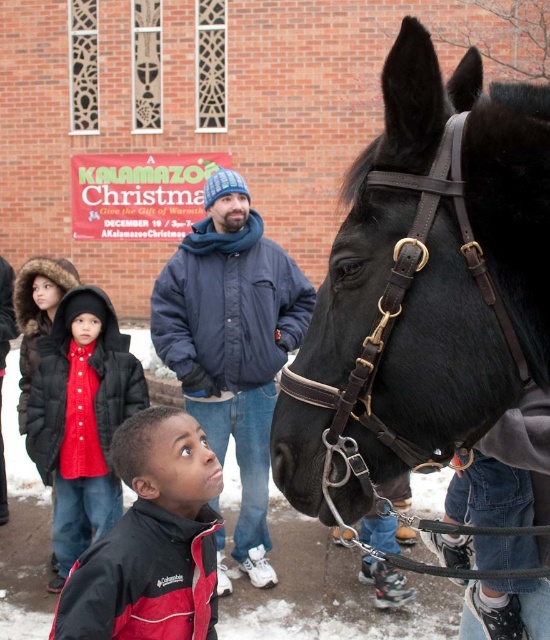
Consider the image. You are a photographer at the event and want to take a photo that includes both the dark blue jacket at center and the red jacket at lower left. Which jacket should you focus on first to ensure both are in the frame?

You should focus on the dark blue jacket at center first because it is closer to the viewer than the red jacket at lower left, ensuring it stays in the frame while adjusting for the background jacket.

You are a photographer trying to capture a photo of the black leather horse at center and the dark blue jacket at center. Based on their positions, which object should you focus on first to ensure both are in frame?

The black leather horse at center is located above the dark blue jacket at center, so you should focus on the dark blue jacket at center first to ensure both are in frame.